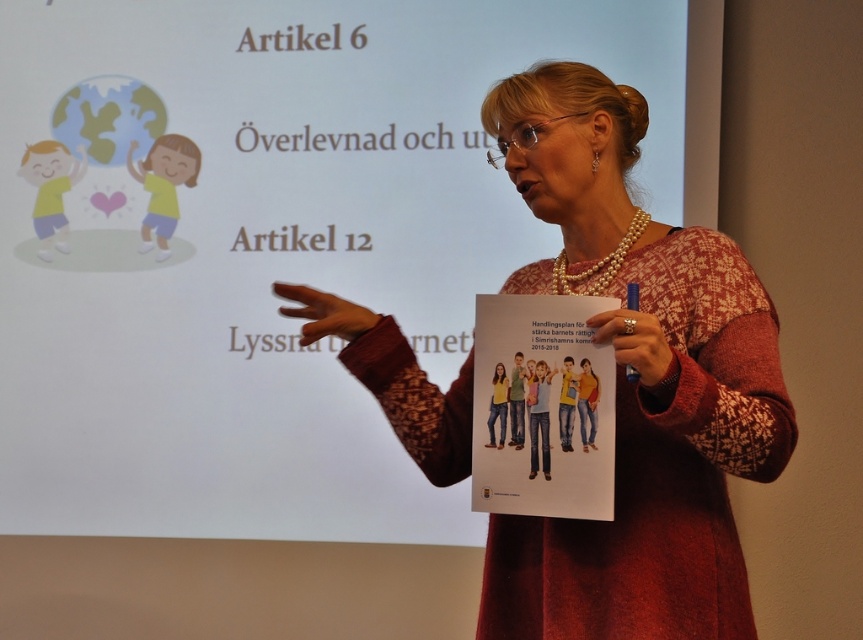
Question: Which point is farther to the camera?

Choices:
 (A) white paper at center
 (B) knitted sweater at center

Answer: (A)

Question: Among these points, which one is farthest from the camera?

Choices:
 (A) (635, 138)
 (B) (224, 227)

Answer: (B)

Question: Does white paper at center have a greater width compared to knitted sweater at center?

Choices:
 (A) yes
 (B) no

Answer: (A)

Question: Does white paper at center have a greater width compared to knitted sweater at center?

Choices:
 (A) no
 (B) yes

Answer: (B)

Question: Is white paper at center to the left of knitted sweater at center from the viewer's perspective?

Choices:
 (A) no
 (B) yes

Answer: (B)